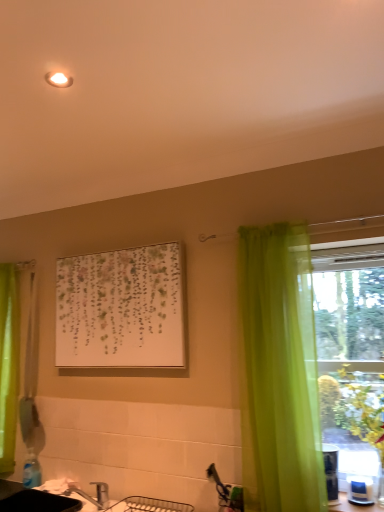
Question: Considering the relative sizes of white glossy counter top at lower right and green leafy plant at right in the image provided, is white glossy counter top at lower right taller than green leafy plant at right?

Choices:
 (A) no
 (B) yes

Answer: (A)

Question: Is white glossy counter top at lower right positioned beyond the bounds of green leafy plant at right?

Choices:
 (A) no
 (B) yes

Answer: (A)

Question: Is white glossy counter top at lower right aimed at green leafy plant at right?

Choices:
 (A) no
 (B) yes

Answer: (A)

Question: Considering the relative positions of white glossy counter top at lower right and green leafy plant at right in the image provided, is white glossy counter top at lower right in front of green leafy plant at right?

Choices:
 (A) yes
 (B) no

Answer: (B)

Question: Can you confirm if white glossy counter top at lower right is positioned to the right of green leafy plant at right?

Choices:
 (A) no
 (B) yes

Answer: (A)

Question: Considering the positions of translucent green curtain at right, marked as the 1th curtain in a front-to-back arrangement, and green leafy plant at right in the image, is translucent green curtain at right, marked as the 1th curtain in a front-to-back arrangement, taller or shorter than green leafy plant at right?

Choices:
 (A) short
 (B) tall

Answer: (B)

Question: Do you think translucent green curtain at right, arranged as the 2th curtain when viewed from the left, is within green leafy plant at right, or outside of it?

Choices:
 (A) inside
 (B) outside

Answer: (B)

Question: Considering their positions, is translucent green curtain at right, marked as the 1th curtain in a front-to-back arrangement, located in front of or behind green leafy plant at right?

Choices:
 (A) front
 (B) behind

Answer: (B)

Question: Does point (294, 224) appear closer or farther from the camera than point (337, 411)?

Choices:
 (A) closer
 (B) farther

Answer: (B)

Question: From the image's perspective, is green leafy plant at right positioned above or below green sheer curtain at left, marked as the second curtain in a right-to-left arrangement?

Choices:
 (A) above
 (B) below

Answer: (B)

Question: Is green leafy plant at right wider or thinner than green sheer curtain at left, placed as the second curtain when sorted from front to back?

Choices:
 (A) wide
 (B) thin

Answer: (A)

Question: From a real-world perspective, is green leafy plant at right physically located above or below green sheer curtain at left, marked as the second curtain in a right-to-left arrangement?

Choices:
 (A) below
 (B) above

Answer: (A)

Question: Is point (359, 395) closer or farther from the camera than point (4, 360)?

Choices:
 (A) closer
 (B) farther

Answer: (A)

Question: Looking at their shapes, would you say green sheer curtain at left, which is counted as the 1th curtain, starting from the back, is wider or thinner than brushed metal faucet at lower left?

Choices:
 (A) thin
 (B) wide

Answer: (A)

Question: Considering the positions of green sheer curtain at left, which is counted as the 1th curtain, starting from the back, and brushed metal faucet at lower left in the image, is green sheer curtain at left, which is counted as the 1th curtain, starting from the back, bigger or smaller than brushed metal faucet at lower left?

Choices:
 (A) small
 (B) big

Answer: (B)